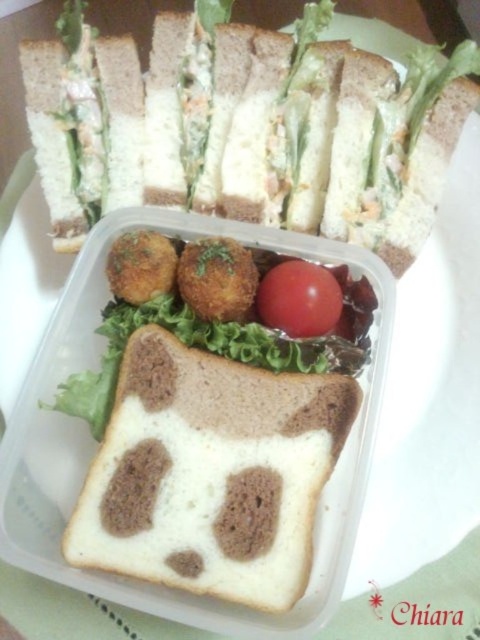
You are packing a lunchbox and want to place both the white bread with brown filling at center and the red smooth tomato at center into a compartment that can only fit items up to the size of the tomato. Will both items fit?

The white bread with brown filling at center is larger than the red smooth tomato at center, so it won not fit in the compartment designed for the tomato size. Only the red smooth tomato at center will fit.

You are a food critic observing the meal. You notice the white bread with brown filling at center and the red smooth tomato at center. Which of these two items is positioned closer to you?

The white bread with brown filling at center is closer to the viewer than the red smooth tomato at center.

You are packing a lunchbox and want to place the white bread with brown filling at center and the red smooth tomato at center in a row. According to the image, which one should you place on the left side?

The white bread with brown filling at center should be placed on the left side of the red smooth tomato at center because it is positioned on the left side in the image.